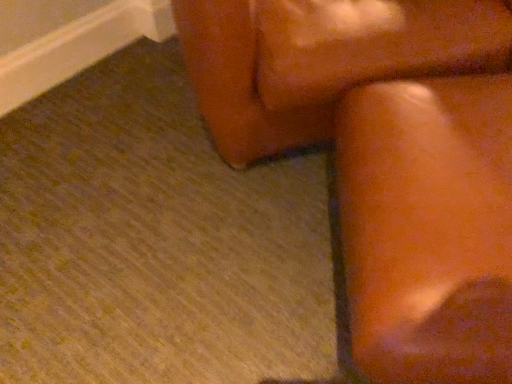
Question: Does leather couch at upper right, which is counted as the first furniture, starting from the top, have a lesser width compared to brown leather rocking chair at upper right?

Choices:
 (A) yes
 (B) no

Answer: (A)

Question: Is leather couch at upper right, which is counted as the first furniture, starting from the top, to the right of brown leather rocking chair at upper right from the viewer's perspective?

Choices:
 (A) no
 (B) yes

Answer: (B)

Question: Is leather couch at upper right, the second furniture positioned from the bottom, positioned with its back to brown leather rocking chair at upper right?

Choices:
 (A) yes
 (B) no

Answer: (B)

Question: Is the depth of leather couch at upper right, which is counted as the first furniture, starting from the top, greater than that of brown leather rocking chair at upper right?

Choices:
 (A) no
 (B) yes

Answer: (B)

Question: Can you confirm if leather couch at upper right, the second furniture positioned from the bottom, is positioned to the left of brown leather rocking chair at upper right?

Choices:
 (A) yes
 (B) no

Answer: (B)

Question: From the image's perspective, is matte brown couch at right, which is counted as the first furniture, starting from the bottom, located above or below leather couch at upper right, which is counted as the first furniture, starting from the top?

Choices:
 (A) below
 (B) above

Answer: (A)

Question: Considering the positions of matte brown couch at right, positioned as the second furniture in top-to-bottom order, and leather couch at upper right, the second furniture positioned from the bottom, in the image, is matte brown couch at right, positioned as the second furniture in top-to-bottom order, bigger or smaller than leather couch at upper right, the second furniture positioned from the bottom,?

Choices:
 (A) big
 (B) small

Answer: (B)

Question: Is matte brown couch at right, which is counted as the first furniture, starting from the bottom, situated inside leather couch at upper right, the second furniture positioned from the bottom, or outside?

Choices:
 (A) outside
 (B) inside

Answer: (A)

Question: Looking at their shapes, would you say matte brown couch at right, positioned as the second furniture in top-to-bottom order, is wider or thinner than leather couch at upper right, the second furniture positioned from the bottom?

Choices:
 (A) wide
 (B) thin

Answer: (B)

Question: In the image, is brown leather rocking chair at upper right positioned in front of or behind leather couch at upper right, which is counted as the first furniture, starting from the top?

Choices:
 (A) behind
 (B) front

Answer: (B)

Question: Looking at the image, does brown leather rocking chair at upper right seem bigger or smaller compared to leather couch at upper right, which is counted as the first furniture, starting from the top?

Choices:
 (A) big
 (B) small

Answer: (B)

Question: From the image's perspective, is brown leather rocking chair at upper right located above or below leather couch at upper right, the second furniture positioned from the bottom?

Choices:
 (A) below
 (B) above

Answer: (A)

Question: From a real-world perspective, is brown leather rocking chair at upper right positioned above or below leather couch at upper right, the second furniture positioned from the bottom?

Choices:
 (A) below
 (B) above

Answer: (A)

Question: Considering the positions of leather couch at upper right, which is counted as the first furniture, starting from the top, and matte brown couch at right, positioned as the second furniture in top-to-bottom order, in the image, is leather couch at upper right, which is counted as the first furniture, starting from the top, wider or thinner than matte brown couch at right, positioned as the second furniture in top-to-bottom order,?

Choices:
 (A) thin
 (B) wide

Answer: (B)

Question: Based on their sizes in the image, would you say leather couch at upper right, which is counted as the first furniture, starting from the top, is bigger or smaller than matte brown couch at right, which is counted as the first furniture, starting from the bottom?

Choices:
 (A) big
 (B) small

Answer: (A)